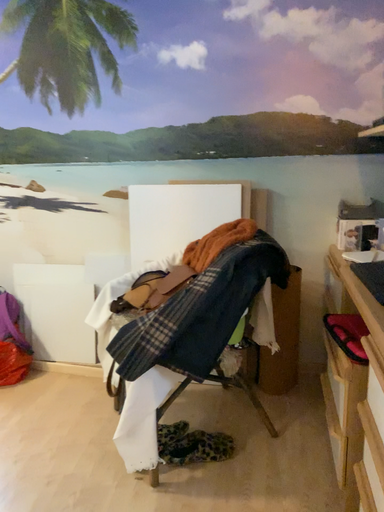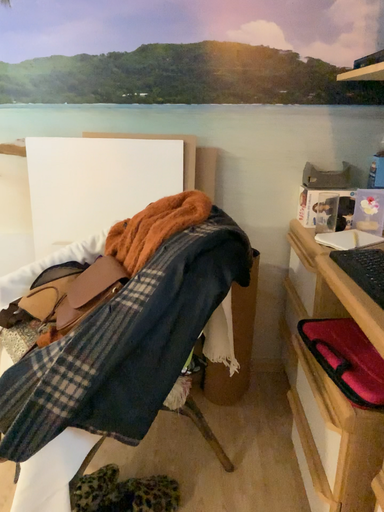
Question: How did the camera likely rotate when shooting the video?

Choices:
 (A) rotated left
 (B) rotated right

Answer: (B)